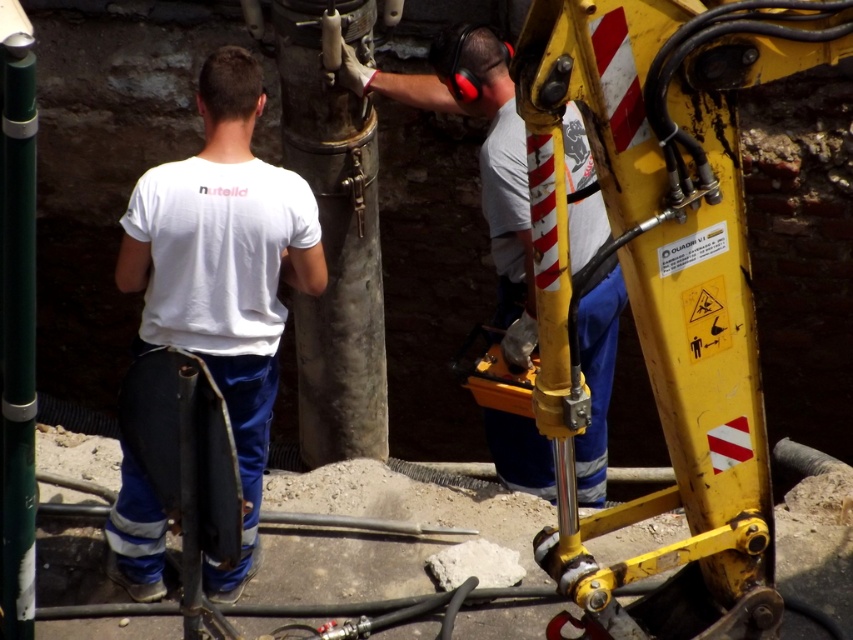
Question: In this image, where is white cotton shirt at center located relative to matte yellow tool at center?

Choices:
 (A) right
 (B) left

Answer: (B)

Question: Which point is closer to the camera?

Choices:
 (A) matte yellow tool at center
 (B) white cotton shirt at center

Answer: (B)

Question: Is white cotton shirt at center positioned at the back of matte yellow tool at center?

Choices:
 (A) no
 (B) yes

Answer: (A)

Question: Which point is farther to the camera?

Choices:
 (A) [x=587, y=172]
 (B) [x=212, y=586]

Answer: (B)

Question: Considering the relative positions of white cotton shirt at center and matte yellow tool at center in the image provided, where is white cotton shirt at center located with respect to matte yellow tool at center?

Choices:
 (A) right
 (B) left

Answer: (B)